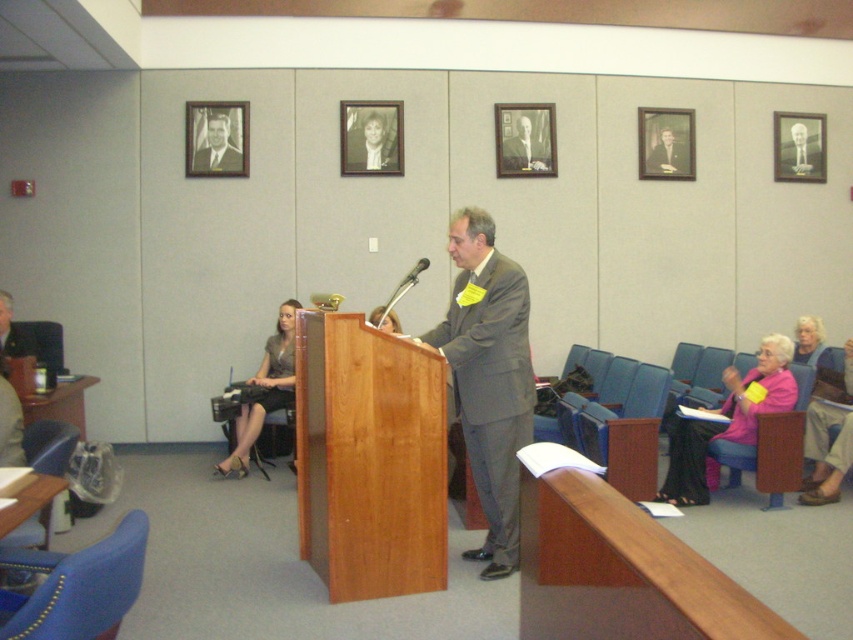
You are an event planner organizing a presentation in this room. You need to ensure the formal suit at center can be seen clearly by the audience. Considering the black wood picture frame at upper center, which object is wider and might block the view?

The black wood picture frame at upper center is wider than the formal suit at center, so it might block the view.